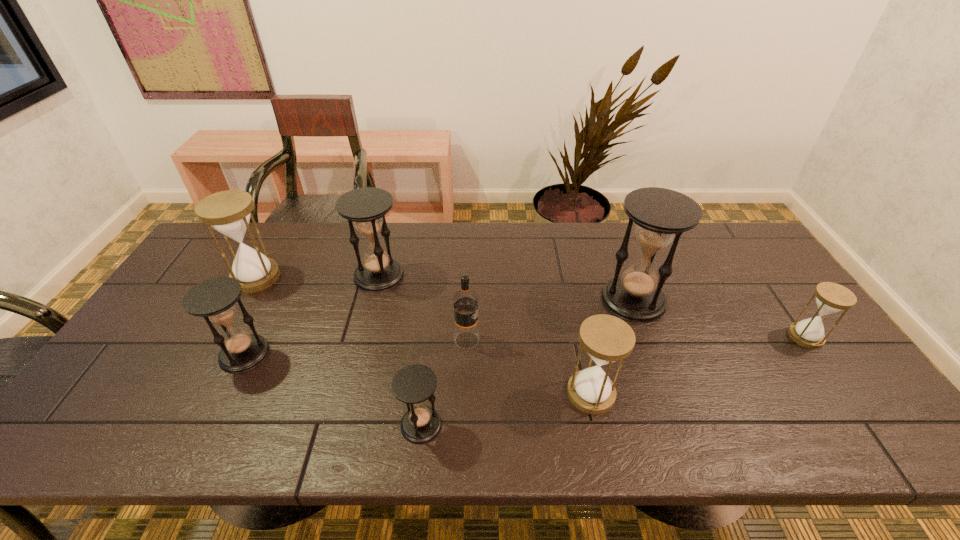
Where is `the second hourglass from right to left`? the second hourglass from right to left is located at coordinates (661, 215).

The width and height of the screenshot is (960, 540). Find the location of `the tallest hourglass`. the tallest hourglass is located at coordinates (661, 215).

Where is `the second black hourglass from left to right`? the second black hourglass from left to right is located at coordinates (366, 207).

The image size is (960, 540). In order to click on the sixth object from right to left in this screenshot , I will do `click(366, 207)`.

You are a GUI agent. You are given a task and a screenshot of the screen. Output one action in this format:
    pyautogui.click(x=<x>, y=<y>)
    Task: Click on the farthest white hourglass
    This screenshot has width=960, height=540.
    Given the screenshot: What is the action you would take?
    pyautogui.click(x=228, y=212)

Where is `the biggest white hourglass`? the biggest white hourglass is located at coordinates (228, 212).

The image size is (960, 540). I want to click on the fifth object from left to right, so click(x=465, y=301).

This screenshot has height=540, width=960. What are the coordinates of `the third farthest black hourglass` in the screenshot? It's located at (214, 299).

Identify the location of the third biggest black hourglass. Image resolution: width=960 pixels, height=540 pixels. (214, 299).

Identify the location of the second white hourglass from left to right. The height and width of the screenshot is (540, 960). (606, 338).